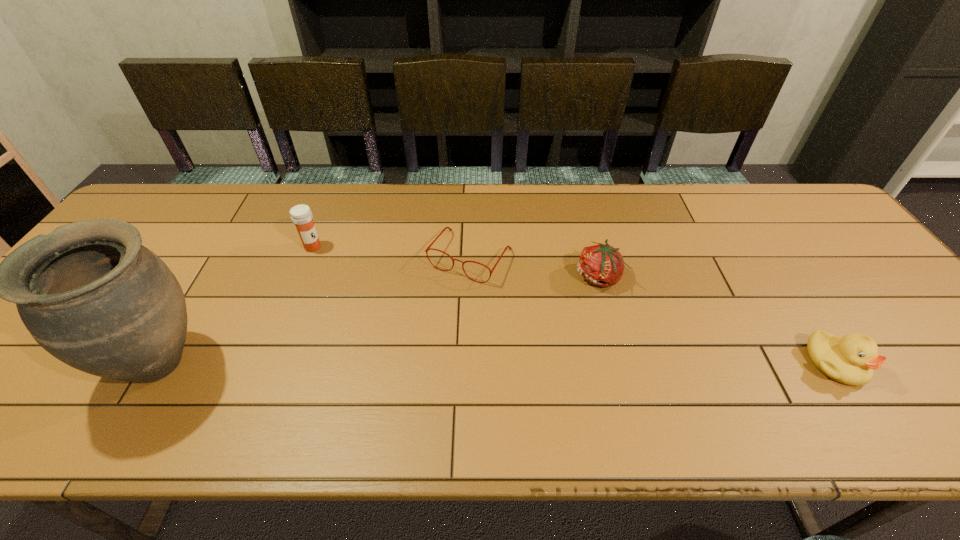
This screenshot has width=960, height=540. In order to click on urn in this screenshot , I will do `click(89, 293)`.

Image resolution: width=960 pixels, height=540 pixels. What are the coordinates of `the tallest object` in the screenshot? It's located at (89, 293).

In order to click on duckling in this screenshot , I will do `click(850, 360)`.

Find the location of a particular element. the fourth shortest object is located at coordinates (301, 215).

Locate an element on the screen. The image size is (960, 540). medicine is located at coordinates (301, 215).

Locate an element on the screen. tomato is located at coordinates pos(602,265).

Where is `spectacles`? The width and height of the screenshot is (960, 540). spectacles is located at coordinates (428, 248).

Locate an element on the screen. The height and width of the screenshot is (540, 960). the shortest object is located at coordinates (428, 248).

Find the location of `vacant space located on the left of the urn`. vacant space located on the left of the urn is located at coordinates (24, 362).

Locate an element on the screen. vacant space located 0.050m on the label side of the fourth shortest object is located at coordinates click(330, 259).